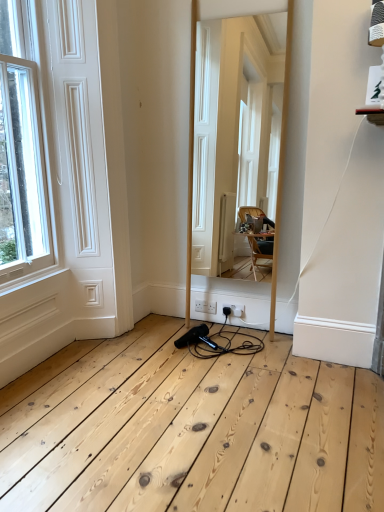
Question: Should I look upward or downward to see wooden mirror at center?

Choices:
 (A) down
 (B) up

Answer: (B)